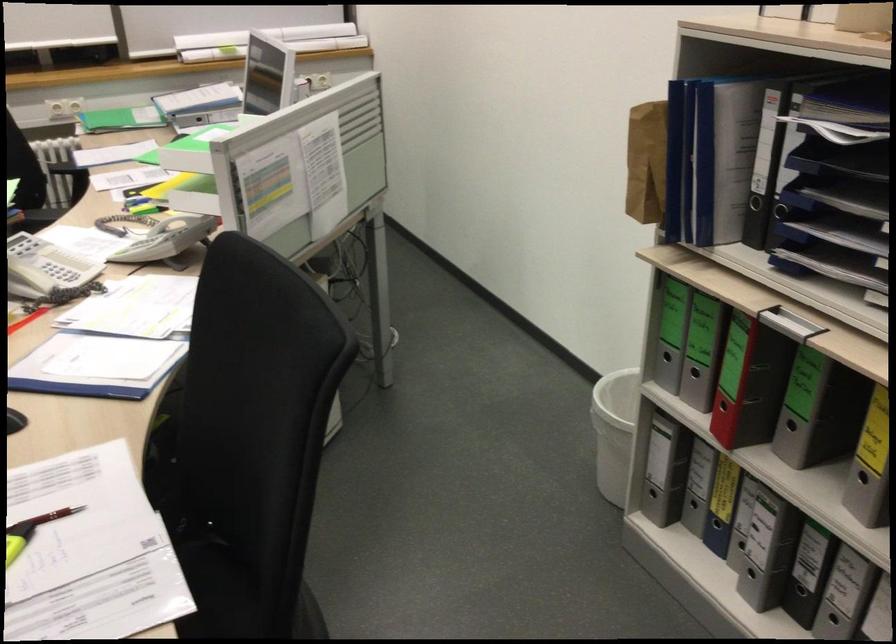
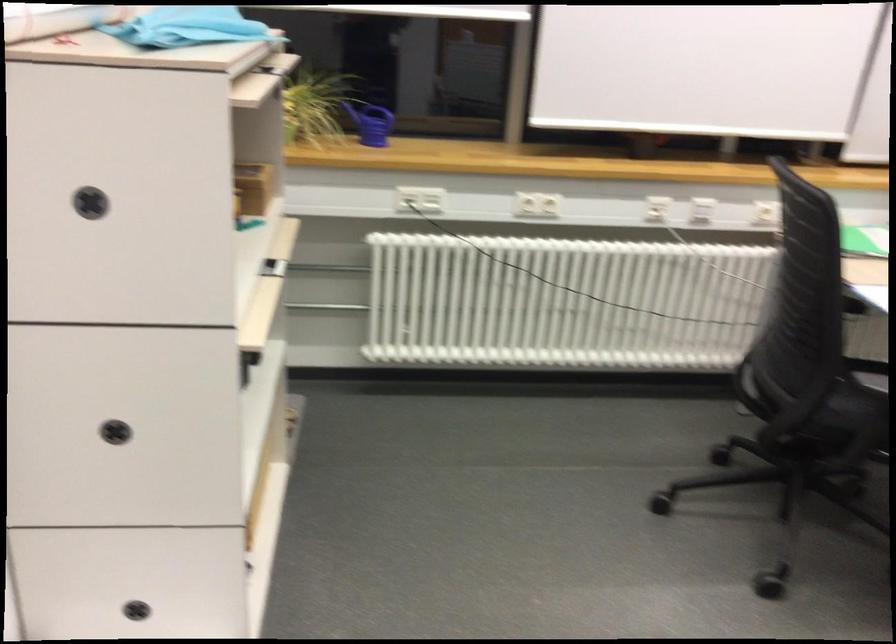
What movement of the cameraman would produce the second image?

The cameraman walked toward left, forward.